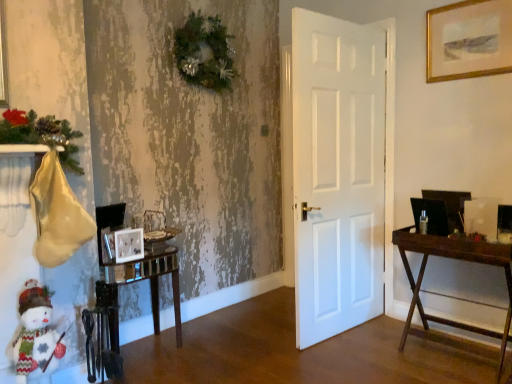
Question: From the image's perspective, is wooden desk at right on top of matte white picture frame at lower left, the 2th picture frame positioned from the bottom?

Choices:
 (A) yes
 (B) no

Answer: (B)

Question: Considering the relative positions of wooden desk at right and matte white picture frame at lower left, placed as the 2th picture frame when sorted from left to right, in the image provided, is wooden desk at right to the left of matte white picture frame at lower left, placed as the 2th picture frame when sorted from left to right, from the viewer's perspective?

Choices:
 (A) yes
 (B) no

Answer: (B)

Question: Is wooden desk at right positioned in front of matte white picture frame at lower left, the 2th picture frame positioned from the bottom?

Choices:
 (A) yes
 (B) no

Answer: (A)

Question: Is wooden desk at right outside of matte white picture frame at lower left, the 2th picture frame positioned from the bottom?

Choices:
 (A) no
 (B) yes

Answer: (B)

Question: From the image's perspective, would you say wooden desk at right is shown under matte white picture frame at lower left, the second picture frame when ordered from right to left?

Choices:
 (A) yes
 (B) no

Answer: (A)

Question: Can you confirm if wooden desk at right is thinner than matte white picture frame at lower left, marked as the second picture frame in a top-to-bottom arrangement?

Choices:
 (A) yes
 (B) no

Answer: (B)

Question: Does matte silver picture frame at lower left, which appears as the 1th picture frame when viewed from the left, have a greater height compared to knitted fabric snowman at lower left?

Choices:
 (A) yes
 (B) no

Answer: (B)

Question: Could you tell me if matte silver picture frame at lower left, which is counted as the 3th picture frame, starting from the top, is facing knitted fabric snowman at lower left?

Choices:
 (A) no
 (B) yes

Answer: (A)

Question: Is the depth of matte silver picture frame at lower left, which is counted as the 3th picture frame, starting from the top, less than that of knitted fabric snowman at lower left?

Choices:
 (A) yes
 (B) no

Answer: (B)

Question: Is matte silver picture frame at lower left, which is counted as the 3th picture frame, starting from the top, positioned beyond the bounds of knitted fabric snowman at lower left?

Choices:
 (A) yes
 (B) no

Answer: (A)

Question: Is matte silver picture frame at lower left, placed as the third picture frame when sorted from right to left, thinner than knitted fabric snowman at lower left?

Choices:
 (A) yes
 (B) no

Answer: (A)

Question: Could you tell me if gold-framed artwork at upper right, the 3th picture frame from the left, is turned towards matte silver picture frame at lower left, which is counted as the 3th picture frame, starting from the top?

Choices:
 (A) no
 (B) yes

Answer: (A)